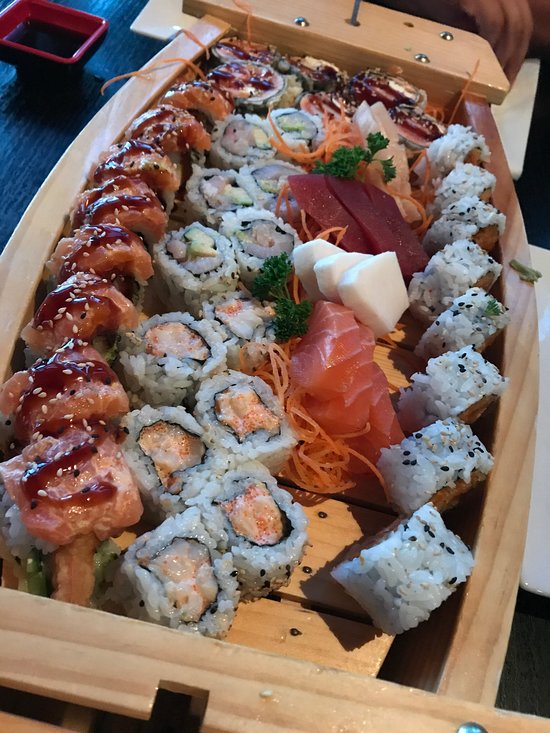
The width and height of the screenshot is (550, 733). Identify the location of small tray. (66, 56).